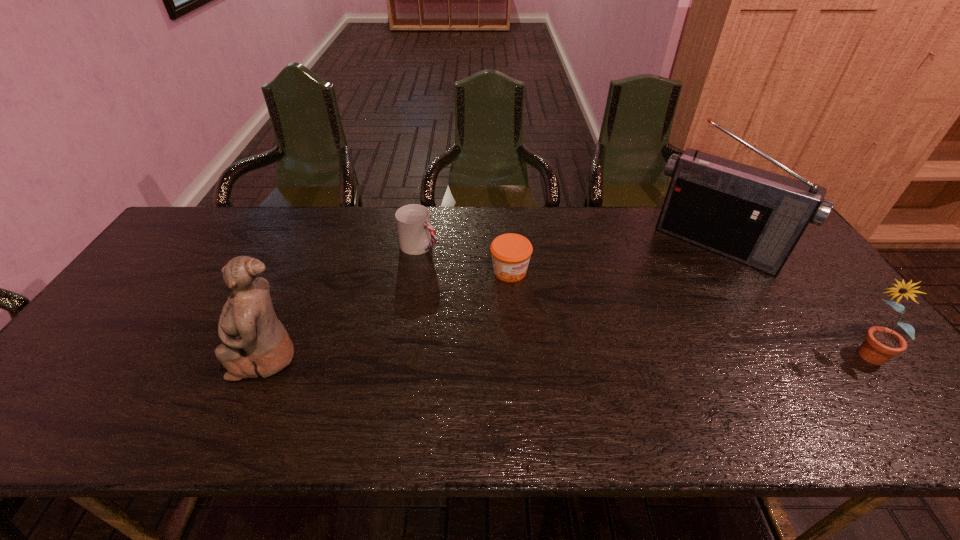
I want to click on cup that is at the far edge, so click(x=416, y=235).

Locate an element on the screen. The width and height of the screenshot is (960, 540). radio receiver situated at the far edge is located at coordinates (755, 217).

You are a GUI agent. You are given a task and a screenshot of the screen. Output one action in this format:
    pyautogui.click(x=<x>, y=<y>)
    Task: Click on the figurine that is positioned at the near edge
    The width and height of the screenshot is (960, 540).
    Given the screenshot: What is the action you would take?
    point(255,343)

The height and width of the screenshot is (540, 960). I want to click on sunflower positioned at the near edge, so click(881, 343).

This screenshot has height=540, width=960. What are the coordinates of `sunflower located in the right edge section of the desktop` in the screenshot? It's located at (881, 343).

The height and width of the screenshot is (540, 960). What are the coordinates of `radio receiver that is at the right edge` in the screenshot? It's located at (755, 217).

The width and height of the screenshot is (960, 540). What are the coordinates of `object that is positioned at the far right corner` in the screenshot? It's located at (755, 217).

Where is `object that is at the near right corner`? object that is at the near right corner is located at coordinates (881, 343).

Where is `vacant space at the far edge of the desktop`? This screenshot has height=540, width=960. vacant space at the far edge of the desktop is located at coordinates [x=545, y=228].

Find the location of a particular element. The width and height of the screenshot is (960, 540). free space at the near edge is located at coordinates (229, 400).